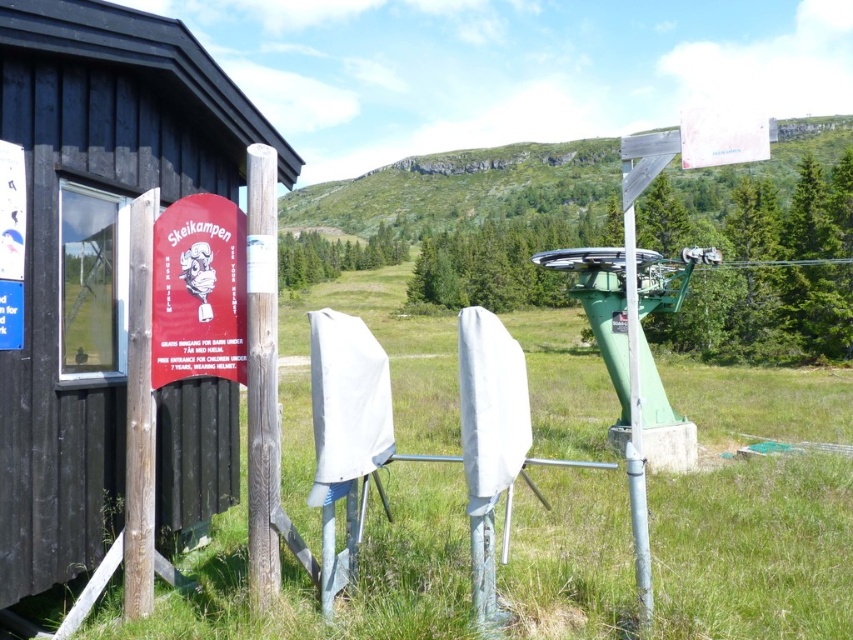
Question: Is black wood hut at left thinner than wooden post at left?

Choices:
 (A) no
 (B) yes

Answer: (A)

Question: Among these objects, which one is nearest to the camera?

Choices:
 (A) black wood hut at left
 (B) red fabric sign at left
 (C) brown wooden pole at left
 (D) wooden post at left

Answer: (A)

Question: Is red fabric sign at left below wooden post at left?

Choices:
 (A) yes
 (B) no

Answer: (B)

Question: Which point is closer to the camera?

Choices:
 (A) (233, 353)
 (B) (625, 161)
 (C) (149, 582)
 (D) (273, 180)

Answer: (A)

Question: Is red fabric sign at left smaller than wooden post at left?

Choices:
 (A) no
 (B) yes

Answer: (B)

Question: Estimate the real-world distances between objects in this image. Which object is closer to the black wood hut at left?

Choices:
 (A) wooden post at left
 (B) red fabric sign at left
 (C) metallic pole at right

Answer: (B)